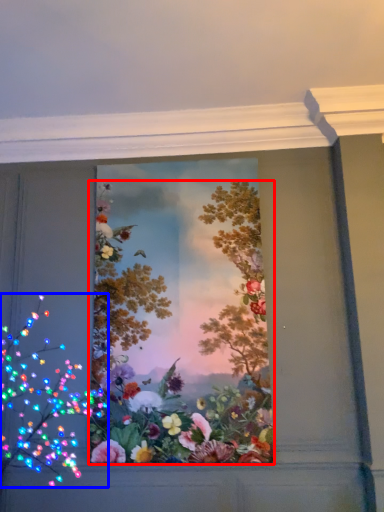
Question: Which of the following is the farthest to the observer, flower (highlighted by a red box) or flower (highlighted by a blue box)?

Choices:
 (A) flower
 (B) flower

Answer: (A)